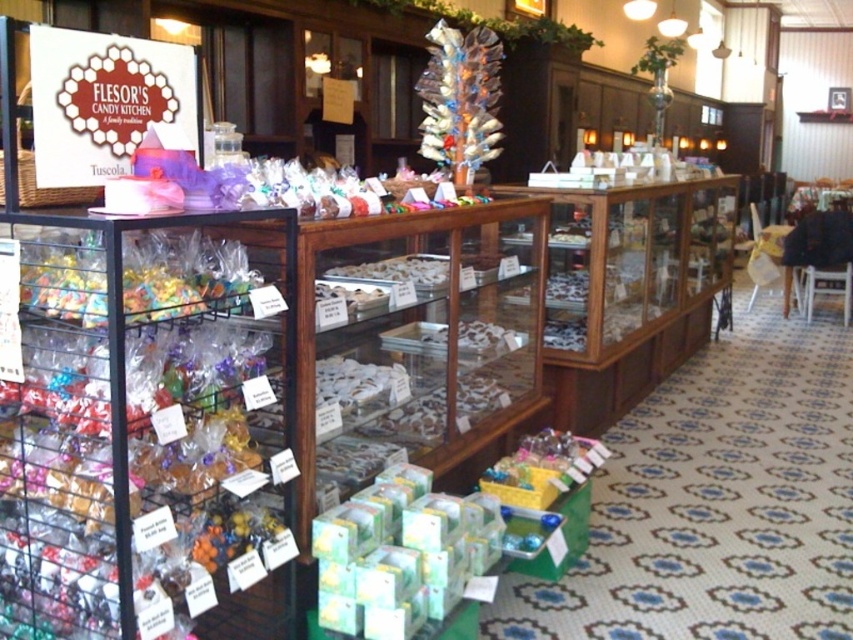
You are a customer in Flesor Candy Kitchen and want to buy the biggest candy available. Which one should you choose between the translucent plastic candy at upper center and the white glossy chocolate at center?

The translucent plastic candy at upper center is bigger than the white glossy chocolate at center, so you should choose the translucent plastic candy at upper center.

You are a customer at Flesor Candy Kitchen. You see a translucent plastic candy at upper center and a white glossy chocolate at center. Which one is taller?

The translucent plastic candy at upper center is taller than the white glossy chocolate at center.